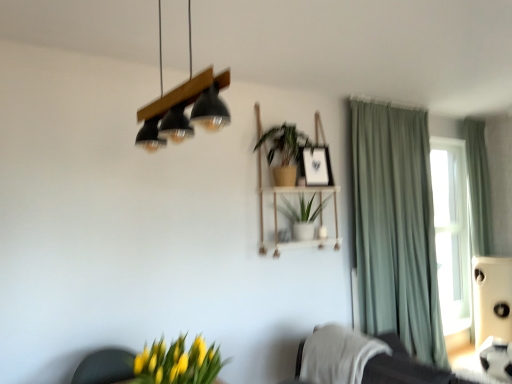
Question: Does white textured blanket at lower right have a greater height compared to green fabric curtain at right, the 1th curtain positioned from the back?

Choices:
 (A) no
 (B) yes

Answer: (A)

Question: Would you say white textured blanket at lower right contains green fabric curtain at right, the 1th curtain positioned from the back?

Choices:
 (A) no
 (B) yes

Answer: (A)

Question: Is white textured blanket at lower right positioned in front of green fabric curtain at right, the 1th curtain positioned from the back?

Choices:
 (A) no
 (B) yes

Answer: (B)

Question: Does white textured blanket at lower right lie behind green fabric curtain at right, placed as the first curtain when sorted from right to left?

Choices:
 (A) no
 (B) yes

Answer: (A)

Question: Can you confirm if white textured blanket at lower right is shorter than green fabric curtain at right, which is counted as the second curtain, starting from the left?

Choices:
 (A) yes
 (B) no

Answer: (A)

Question: Is white textured blanket at lower right taller or shorter than green matte plant at center, the second houseplant in the back-to-front sequence?

Choices:
 (A) short
 (B) tall

Answer: (B)

Question: Is white textured blanket at lower right spatially inside green matte plant at center, which is the 1th houseplant from top to bottom, or outside of it?

Choices:
 (A) outside
 (B) inside

Answer: (A)

Question: From a real-world perspective, relative to green matte plant at center, acting as the 2th houseplant starting from the front, is white textured blanket at lower right vertically above or below?

Choices:
 (A) above
 (B) below

Answer: (B)

Question: Is white textured blanket at lower right to the left or to the right of green matte plant at center, the second houseplant in the back-to-front sequence, in the image?

Choices:
 (A) left
 (B) right

Answer: (B)

Question: Considering their positions, is matte black picture frame at upper center located in front of or behind green fabric curtain at right, the 1th curtain positioned from the back?

Choices:
 (A) behind
 (B) front

Answer: (B)

Question: From a real-world perspective, is matte black picture frame at upper center physically located above or below green fabric curtain at right, placed as the 2th curtain when sorted from front to back?

Choices:
 (A) above
 (B) below

Answer: (A)

Question: Considering the relative positions of matte black picture frame at upper center and green fabric curtain at right, the 1th curtain positioned from the back, in the image provided, is matte black picture frame at upper center to the left or to the right of green fabric curtain at right, the 1th curtain positioned from the back,?

Choices:
 (A) right
 (B) left

Answer: (B)

Question: Considering the positions of matte black picture frame at upper center and green fabric curtain at right, placed as the first curtain when sorted from right to left, in the image, is matte black picture frame at upper center bigger or smaller than green fabric curtain at right, placed as the first curtain when sorted from right to left,?

Choices:
 (A) big
 (B) small

Answer: (B)

Question: Looking at the image, does green matte plant at center, the second houseplant in the back-to-front sequence, seem bigger or smaller compared to green matte plant at center, positioned as the second houseplant in bottom-to-top order?

Choices:
 (A) big
 (B) small

Answer: (B)

Question: Is green matte plant at center, the third houseplant positioned from the bottom, to the left or to the right of green matte plant at center, which is the third houseplant in front-to-back order, in the image?

Choices:
 (A) left
 (B) right

Answer: (A)